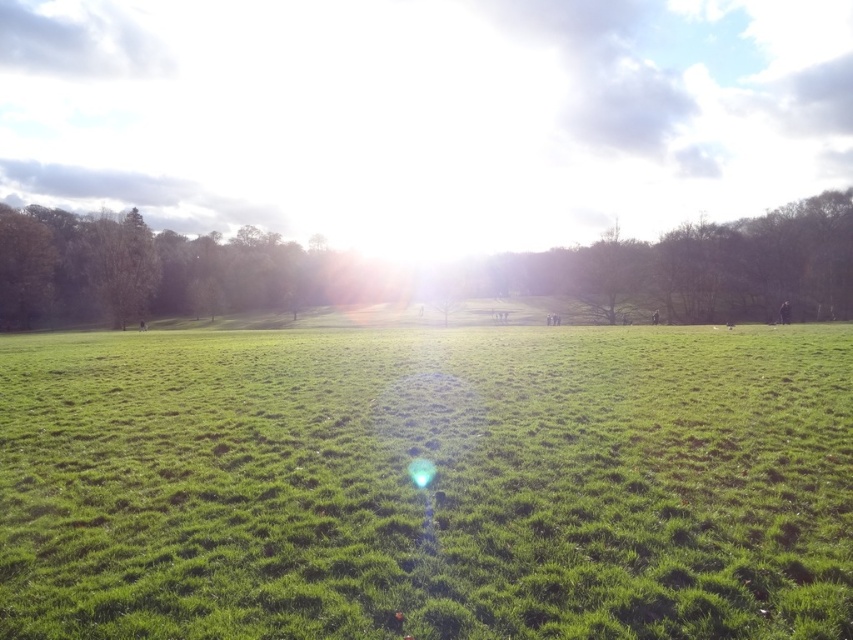
In the scene shown: Is green grass at center in front of green leafy tree at center?

Yes, it is.

Between point (413, 499) and point (624, 310), which one is positioned behind?

Positioned behind is point (624, 310).

What do you see at coordinates (428, 484) in the screenshot?
I see `green grass at center` at bounding box center [428, 484].

Locate an element on the screen. This screenshot has width=853, height=640. green grass at center is located at coordinates (428, 484).

Can you confirm if green leafy tree at left is smaller than green leafy tree at center?

Indeed, green leafy tree at left has a smaller size compared to green leafy tree at center.

Is green leafy tree at left above green leafy tree at center?

No.

This screenshot has height=640, width=853. Find the location of `green leafy tree at left`. green leafy tree at left is located at coordinates (151, 269).

Locate an element on the screen. This screenshot has height=640, width=853. green leafy tree at left is located at coordinates (151, 269).

Who is positioned more to the right, green grass at center or green leafy tree at left?

From the viewer's perspective, green grass at center appears more on the right side.

Does green grass at center have a greater width compared to green leafy tree at left?

No.

Is point (711, 627) positioned in front of point (146, 310)?

Yes, it is.

The height and width of the screenshot is (640, 853). Find the location of `green grass at center`. green grass at center is located at coordinates (428, 484).